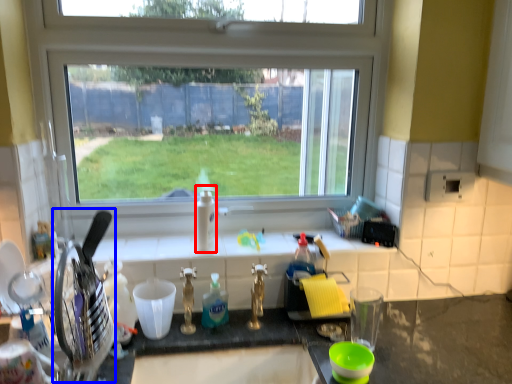
Question: Which object appears closest to the camera in this image, bottle (highlighted by a red box) or appliance (highlighted by a blue box)?

Choices:
 (A) bottle
 (B) appliance

Answer: (B)